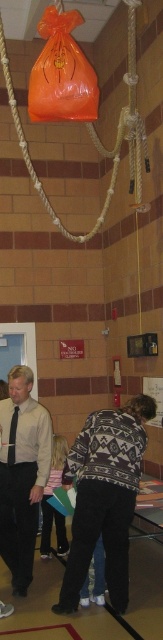
What is the color of the shirt worn by the person located at the coordinates point (22, 474)?

The point (22, 474) corresponds to the matte black shirt at center, so the color is black.

You are organizing a school event and need to place a 1.2 meter tall decoration between the knit sweater at center and the orange plastic bag at upper center. Can the decoration fit vertically between them?

The knit sweater at center is taller than the orange plastic bag at upper center. Since the decoration is 1.2 meters tall, it may not fit vertically between them if the space between the two objects is less than 1.2 meters. However, the exact vertical distance isn not provided in the description. Please measure the space before placing the decoration.